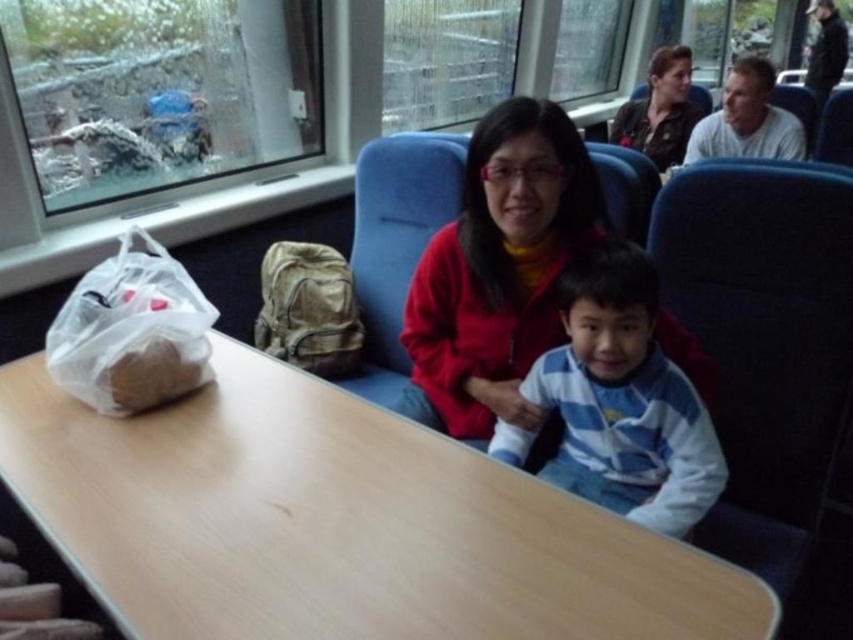
Question: Can you confirm if light brown wood table at center is thinner than camouflage fabric backpack at center?

Choices:
 (A) yes
 (B) no

Answer: (B)

Question: Can you confirm if light brown wood table at center is positioned to the right of camouflage fabric backpack at center?

Choices:
 (A) yes
 (B) no

Answer: (A)

Question: Can you confirm if matte red jacket at center is bigger than clear plastic bag at lower left?

Choices:
 (A) no
 (B) yes

Answer: (B)

Question: Which point is farther to the camera?

Choices:
 (A) light brown wood table at center
 (B) matte black jacket at upper center
 (C) blue striped sweater at center
 (D) white cotton shirt at upper right

Answer: (B)

Question: Estimate the real-world distances between objects in this image. Which object is closer to the light brown wood table at center?

Choices:
 (A) white cotton shirt at upper right
 (B) matte black jacket at upper center

Answer: (A)

Question: Which object is farther from the camera taking this photo?

Choices:
 (A) light brown wood table at center
 (B) white cotton shirt at upper right
 (C) clear plastic bag at lower left
 (D) matte red jacket at center

Answer: (B)